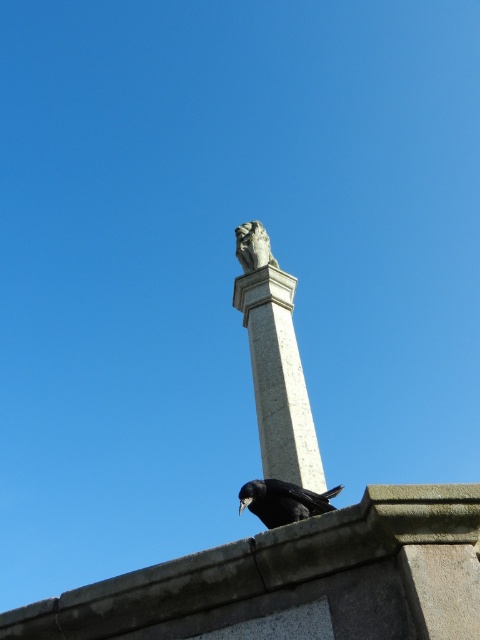
Question: Is white stone column at upper center thinner than shiny black bird at center?

Choices:
 (A) yes
 (B) no

Answer: (B)

Question: Where is white stone column at upper center located in relation to shiny black bird at center in the image?

Choices:
 (A) right
 (B) left

Answer: (B)

Question: Which of the following is the closest to the observer?

Choices:
 (A) (274, 397)
 (B) (299, 515)

Answer: (B)

Question: Which object appears closest to the camera in this image?

Choices:
 (A) white stone column at upper center
 (B) shiny black bird at center

Answer: (B)

Question: Can you confirm if white stone column at upper center is thinner than shiny black bird at center?

Choices:
 (A) no
 (B) yes

Answer: (A)